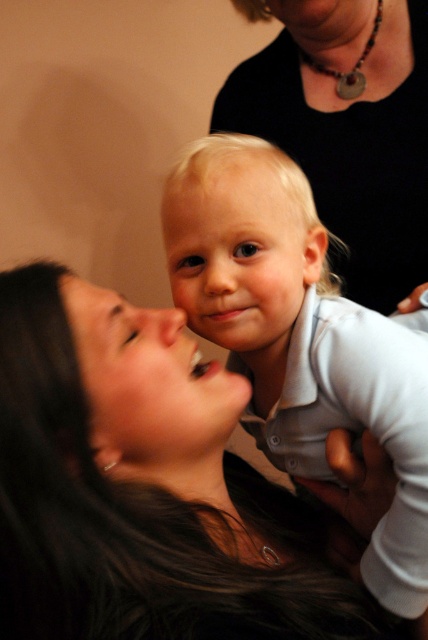
You are an artist sketching this scene and want to highlight the smooth black hair at center. Where exactly should you focus your attention on the image?

You should focus on the point at coordinates (x=143, y=486) to highlight the smooth black hair at center.

In the scene shown: You are an artist trying to sketch this scene. You need to place the blonde hair at center in your drawing. What coordinates should you use for its position?

The blonde hair at center should be placed at coordinates point (300,337).